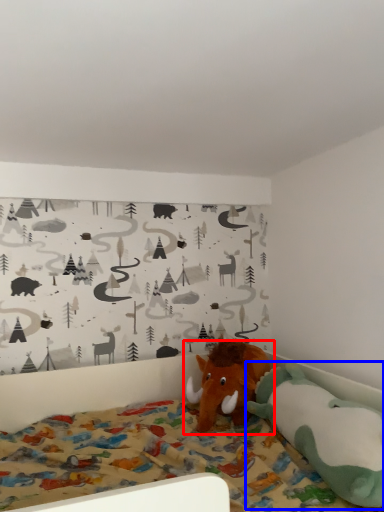
Question: Among these objects, which one is farthest to the camera, toy (highlighted by a red box) or toy (highlighted by a blue box)?

Choices:
 (A) toy
 (B) toy

Answer: (A)